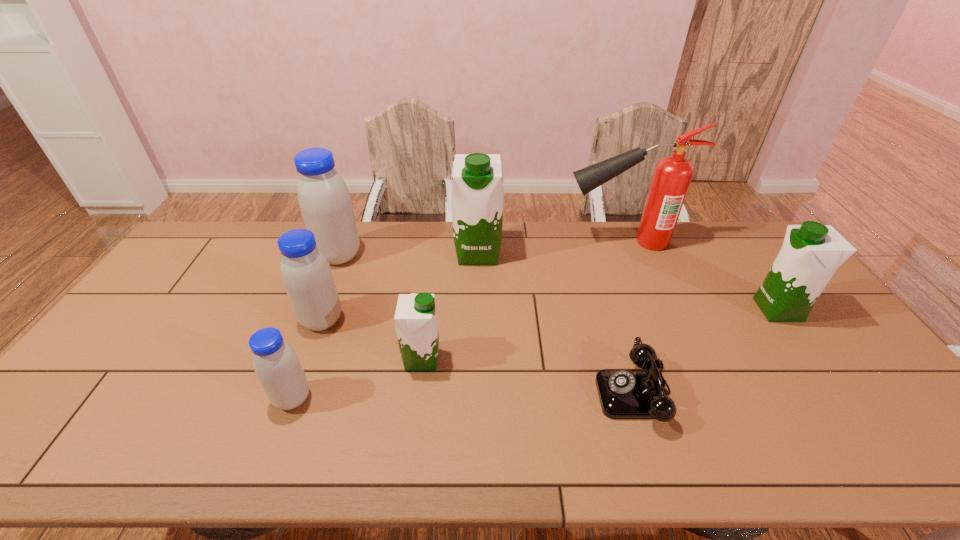
The width and height of the screenshot is (960, 540). I want to click on vacant area in the image that satisfies the following two spatial constraints: 1. on the front-facing side of the rightmost object; 2. on the front side of the smallest blue soya milk, so click(x=842, y=399).

This screenshot has height=540, width=960. Identify the location of vacant space that satisfies the following two spatial constraints: 1. on the dial of the shortest object; 2. on the front side of the nearest soya milk. (636, 399).